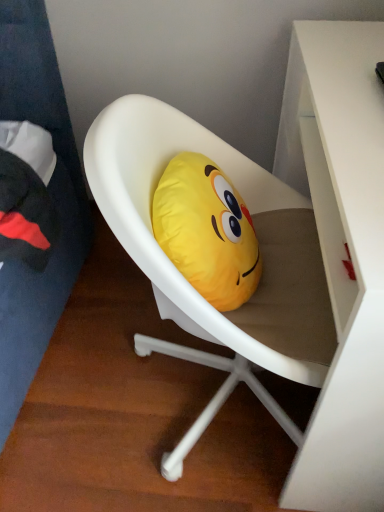
Question: Is yellow fabric emoji pillow at center located within white matte chair at center?

Choices:
 (A) yes
 (B) no

Answer: (A)

Question: Can you confirm if white matte chair at center is wider than yellow fabric emoji pillow at center?

Choices:
 (A) yes
 (B) no

Answer: (A)

Question: Is white matte chair at center not within yellow fabric emoji pillow at center?

Choices:
 (A) yes
 (B) no

Answer: (A)

Question: From a real-world perspective, is white matte chair at center below yellow fabric emoji pillow at center?

Choices:
 (A) no
 (B) yes

Answer: (B)

Question: Is white matte chair at center further to camera compared to yellow fabric emoji pillow at center?

Choices:
 (A) yes
 (B) no

Answer: (B)

Question: Does white matte chair at center turn towards yellow fabric emoji pillow at center?

Choices:
 (A) yes
 (B) no

Answer: (A)

Question: Is yellow fabric emoji pillow at center at the right side of white glossy desk at upper right?

Choices:
 (A) no
 (B) yes

Answer: (A)

Question: From a real-world perspective, does yellow fabric emoji pillow at center sit lower than white glossy desk at upper right?

Choices:
 (A) no
 (B) yes

Answer: (A)

Question: From the image's perspective, would you say yellow fabric emoji pillow at center is positioned over white glossy desk at upper right?

Choices:
 (A) yes
 (B) no

Answer: (A)

Question: Considering the relative positions of yellow fabric emoji pillow at center and white glossy desk at upper right in the image provided, is yellow fabric emoji pillow at center behind white glossy desk at upper right?

Choices:
 (A) yes
 (B) no

Answer: (A)

Question: Can white glossy desk at upper right be found inside yellow fabric emoji pillow at center?

Choices:
 (A) no
 (B) yes

Answer: (A)

Question: Is yellow fabric emoji pillow at center not within white glossy desk at upper right?

Choices:
 (A) yes
 (B) no

Answer: (A)

Question: Does white glossy desk at upper right have a greater width compared to yellow fabric emoji pillow at center?

Choices:
 (A) yes
 (B) no

Answer: (A)